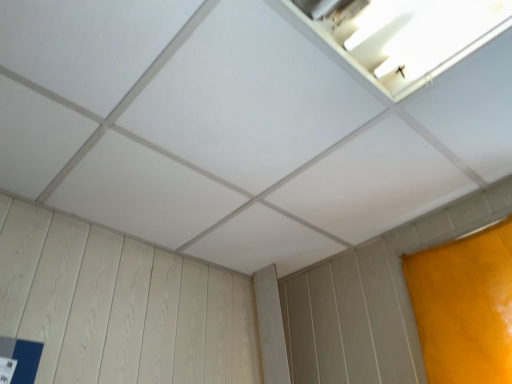
Measure the distance between white plastic window at upper right and camera.

white plastic window at upper right is 3.41 feet from camera.

You are a GUI agent. You are given a task and a screenshot of the screen. Output one action in this format:
    pyautogui.click(x=<x>, y=<y>)
    Task: Click on the white plastic window at upper right
    
    Given the screenshot: What is the action you would take?
    pyautogui.click(x=414, y=36)

Describe the element at coordinates (414, 36) in the screenshot. I see `white plastic window at upper right` at that location.

Find the location of a particular element. white plastic window at upper right is located at coordinates (414, 36).